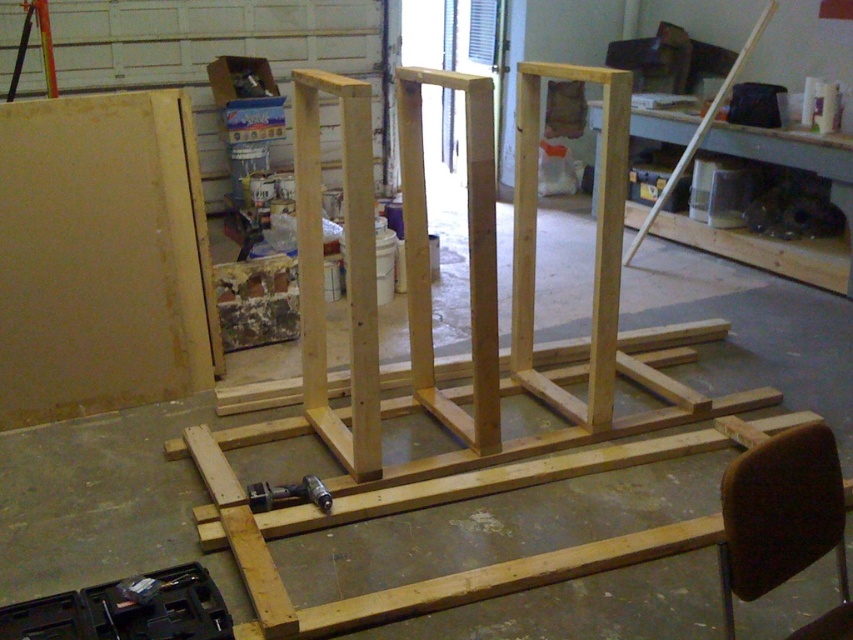
Question: Can you confirm if matte yellow wood at left is smaller than metallic gray drill at center?

Choices:
 (A) yes
 (B) no

Answer: (B)

Question: Among these points, which one is farthest from the camera?

Choices:
 (A) (186, 628)
 (B) (814, 269)
 (C) (258, 492)

Answer: (B)

Question: Which point is closer to the camera taking this photo?

Choices:
 (A) (770, 588)
 (B) (62, 250)

Answer: (A)

Question: Considering the real-world distances, which object is farthest from the metallic gray drill at center?

Choices:
 (A) light wood workbench at upper right
 (B) black plastic tool box at lower left
 (C) matte yellow wood at left

Answer: (A)

Question: Can you confirm if matte yellow wood at left is positioned to the left of metallic gray drill at center?

Choices:
 (A) yes
 (B) no

Answer: (A)

Question: In this image, where is brown fabric chair at center located relative to light wood workbench at upper right?

Choices:
 (A) below
 (B) above

Answer: (A)